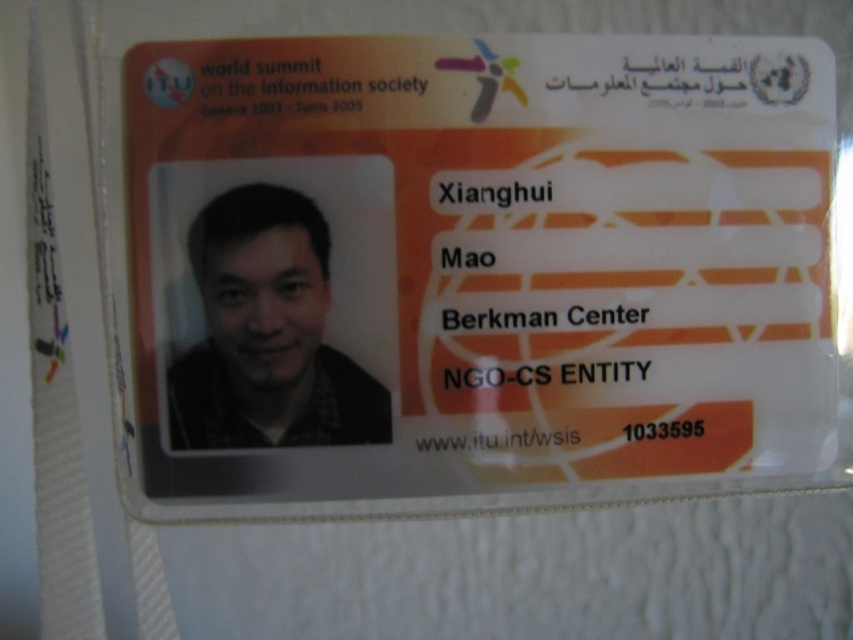
Question: Which object appears closest to the camera in this image?

Choices:
 (A) matte black photo at center
 (B) orange matte id card at center

Answer: (B)

Question: Is orange matte id card at center further to the viewer compared to matte black photo at center?

Choices:
 (A) yes
 (B) no

Answer: (B)

Question: Is orange matte id card at center below matte black photo at center?

Choices:
 (A) no
 (B) yes

Answer: (A)

Question: Is orange matte id card at center above matte black photo at center?

Choices:
 (A) yes
 (B) no

Answer: (A)

Question: Which object appears closest to the camera in this image?

Choices:
 (A) orange matte id card at center
 (B) matte black photo at center

Answer: (A)